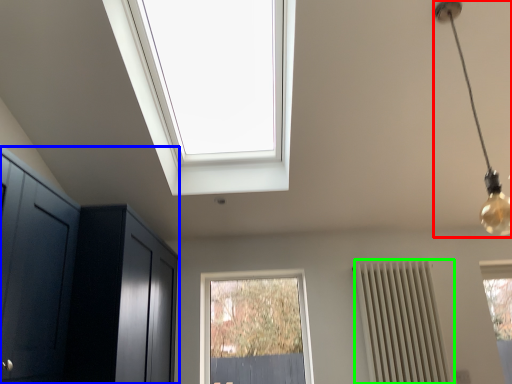
Question: Considering the real-world distances, which object is farthest from light fixture (highlighted by a red box)? dresser (highlighted by a blue box) or radiator (highlighted by a green box)?

Choices:
 (A) dresser
 (B) radiator

Answer: (A)